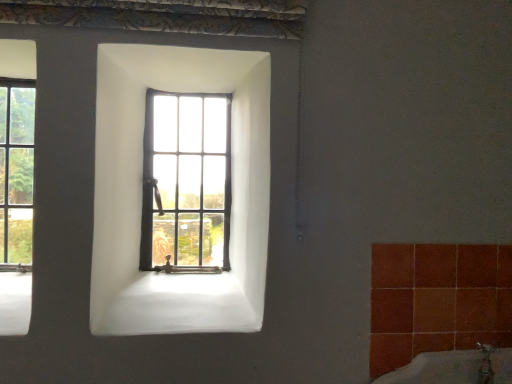
Identify the location of clear glass window at left, the 1th window positioned from the left. (16, 182).

Image resolution: width=512 pixels, height=384 pixels. What do you see at coordinates (16, 182) in the screenshot?
I see `clear glass window at left, the 1th window positioned from the left` at bounding box center [16, 182].

At what (x,y) coordinates should I click in order to perform the action: click on wooden-framed window at center, positioned as the 1th window in right-to-left order. Please return your answer as a coordinate pair (x, y). The image size is (512, 384). Looking at the image, I should click on (186, 182).

The width and height of the screenshot is (512, 384). What do you see at coordinates (186, 182) in the screenshot?
I see `wooden-framed window at center, positioned as the 1th window in right-to-left order` at bounding box center [186, 182].

Where is `clear glass window at left, the 1th window positioned from the left`? Image resolution: width=512 pixels, height=384 pixels. clear glass window at left, the 1th window positioned from the left is located at coordinates (16, 182).

Is clear glass window at left, the 1th window positioned from the left, at the left side of wooden-framed window at center, which is the 2th window from left to right?

Correct, you'll find clear glass window at left, the 1th window positioned from the left, to the left of wooden-framed window at center, which is the 2th window from left to right.

Which object is further away from the camera taking this photo, clear glass window at left, the 1th window positioned from the left, or wooden-framed window at center, which is the 2th window from left to right?

wooden-framed window at center, which is the 2th window from left to right, is more distant.

In the scene shown: Which is nearer, (17,296) or (150,145)?

Point (17,296) is closer to the camera than point (150,145).

From the image's perspective, is clear glass window at left, which appears as the 2th window when viewed from the right, above or below wooden-framed window at center, which is the 2th window from left to right?

From the image's perspective, clear glass window at left, which appears as the 2th window when viewed from the right, appears above wooden-framed window at center, which is the 2th window from left to right.

From a real-world perspective, is clear glass window at left, which appears as the 2th window when viewed from the right, located higher than wooden-framed window at center, which is the 2th window from left to right?

Yes, from a real-world perspective, clear glass window at left, which appears as the 2th window when viewed from the right, is above wooden-framed window at center, which is the 2th window from left to right.

Is clear glass window at left, which appears as the 2th window when viewed from the right, thinner than wooden-framed window at center, which is the 2th window from left to right?

No, clear glass window at left, which appears as the 2th window when viewed from the right, is not thinner than wooden-framed window at center, which is the 2th window from left to right.

Does clear glass window at left, the 1th window positioned from the left, have a lesser height compared to wooden-framed window at center, positioned as the 1th window in right-to-left order?

Incorrect, the height of clear glass window at left, the 1th window positioned from the left, does not fall short of that of wooden-framed window at center, positioned as the 1th window in right-to-left order.

Can you confirm if clear glass window at left, which appears as the 2th window when viewed from the right, is smaller than wooden-framed window at center, which is the 2th window from left to right?

Indeed, clear glass window at left, which appears as the 2th window when viewed from the right, has a smaller size compared to wooden-framed window at center, which is the 2th window from left to right.

Does clear glass window at left, the 1th window positioned from the left, contain wooden-framed window at center, positioned as the 1th window in right-to-left order?

Definitely not — wooden-framed window at center, positioned as the 1th window in right-to-left order, is not inside clear glass window at left, the 1th window positioned from the left.

Is clear glass window at left, the 1th window positioned from the left, beside wooden-framed window at center, which is the 2th window from left to right?

No, clear glass window at left, the 1th window positioned from the left, is not next to wooden-framed window at center, which is the 2th window from left to right.

Is clear glass window at left, the 1th window positioned from the left, oriented towards wooden-framed window at center, which is the 2th window from left to right?

No, clear glass window at left, the 1th window positioned from the left, does not turn towards wooden-framed window at center, which is the 2th window from left to right.

Identify the location of window below the clear glass window at left, the 1th window positioned from the left (from the image's perspective). (186, 182).

Is wooden-framed window at center, which is the 2th window from left to right, at the right side of clear glass window at left, which appears as the 2th window when viewed from the right?

Yes.

Is wooden-framed window at center, which is the 2th window from left to right, behind clear glass window at left, the 1th window positioned from the left?

Result: Yes, it is behind clear glass window at left, the 1th window positioned from the left.

Between point (148, 172) and point (4, 303), which one is positioned behind?

Positioned behind is point (148, 172).

From the image's perspective, is wooden-framed window at center, which is the 2th window from left to right, below clear glass window at left, the 1th window positioned from the left?

Yes, from the image's perspective, wooden-framed window at center, which is the 2th window from left to right, is below clear glass window at left, the 1th window positioned from the left.

From a real-world perspective, which object stands above the other?

clear glass window at left, the 1th window positioned from the left.

In terms of width, does wooden-framed window at center, positioned as the 1th window in right-to-left order, look wider or thinner when compared to clear glass window at left, the 1th window positioned from the left?

Clearly, wooden-framed window at center, positioned as the 1th window in right-to-left order, has less width compared to clear glass window at left, the 1th window positioned from the left.

Who is shorter, wooden-framed window at center, which is the 2th window from left to right, or clear glass window at left, the 1th window positioned from the left?

wooden-framed window at center, which is the 2th window from left to right, is shorter.

Who is bigger, wooden-framed window at center, which is the 2th window from left to right, or clear glass window at left, which appears as the 2th window when viewed from the right?

wooden-framed window at center, which is the 2th window from left to right.

Is clear glass window at left, the 1th window positioned from the left, surrounded by wooden-framed window at center, which is the 2th window from left to right?

No, clear glass window at left, the 1th window positioned from the left, is not surrounded by wooden-framed window at center, which is the 2th window from left to right.

Is wooden-framed window at center, which is the 2th window from left to right, far from clear glass window at left, which appears as the 2th window when viewed from the right?

No, there isn't a large distance between wooden-framed window at center, which is the 2th window from left to right, and clear glass window at left, which appears as the 2th window when viewed from the right.

Is wooden-framed window at center, which is the 2th window from left to right, looking in the opposite direction of clear glass window at left, which appears as the 2th window when viewed from the right?

That's not correct — wooden-framed window at center, which is the 2th window from left to right, is not looking away from clear glass window at left, which appears as the 2th window when viewed from the right.

Looking at this image, can you tell me how much wooden-framed window at center, which is the 2th window from left to right, and clear glass window at left, the 1th window positioned from the left, differ in facing direction?

The facing directions of wooden-framed window at center, which is the 2th window from left to right, and clear glass window at left, the 1th window positioned from the left, are 0.805 degrees apart.

Where is `window that appears in front of the wooden-framed window at center, which is the 2th window from left to right`? The height and width of the screenshot is (384, 512). window that appears in front of the wooden-framed window at center, which is the 2th window from left to right is located at coordinates (16, 182).

At what (x,y) coordinates should I click in order to perform the action: click on window that appears above the wooden-framed window at center, positioned as the 1th window in right-to-left order (from a real-world perspective). Please return your answer as a coordinate pair (x, y). The image size is (512, 384). Looking at the image, I should click on pos(16,182).

Locate an element on the screen. The image size is (512, 384). window in front of the wooden-framed window at center, positioned as the 1th window in right-to-left order is located at coordinates (16, 182).